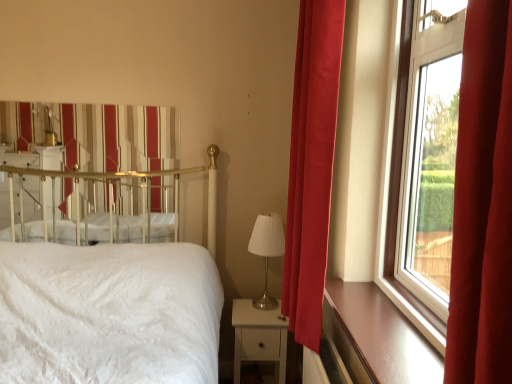
Question: Based on their positions, is silver metallic table lamp at center located to the left or right of white textured bed at left?

Choices:
 (A) right
 (B) left

Answer: (A)

Question: Is silver metallic table lamp at center inside or outside of white textured bed at left?

Choices:
 (A) outside
 (B) inside

Answer: (A)

Question: Based on their relative distances, which object is farther from the white glossy nightstand at lower center?

Choices:
 (A) satin red curtain at right
 (B) metallic gold canopy bed at upper left
 (C) white textured bed at left
 (D) transparent glass window at right
 (E) silver metallic table lamp at center

Answer: (D)

Question: Considering the real-world distances, which object is closest to the white glossy nightstand at lower center?

Choices:
 (A) white textured bed at left
 (B) metallic gold canopy bed at upper left
 (C) brown wood at right
 (D) transparent glass window at right
 (E) satin red curtain at right

Answer: (A)